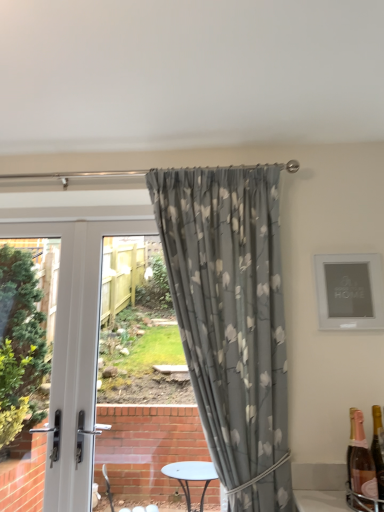
Question: Is gold metallic bottle at lower right, the 2th bottle when ordered from right to left, taller or shorter than white glossy door at left?

Choices:
 (A) short
 (B) tall

Answer: (A)

Question: Does point (364, 437) appear closer or farther from the camera than point (67, 499)?

Choices:
 (A) closer
 (B) farther

Answer: (A)

Question: Which object is the farthest from the matte silver picture frame at upper right?

Choices:
 (A) gray floral fabric curtain at center
 (B) white glossy door at left
 (C) pink glass bottle at lower right, which is counted as the 1th bottle, starting from the back
 (D) gold metallic bottle at lower right, acting as the first bottle starting from the front

Answer: (B)

Question: Estimate the real-world distances between objects in this image. Which object is farther from the gray floral fabric curtain at center?

Choices:
 (A) pink glass bottle at lower right, which is counted as the 1th bottle, starting from the back
 (B) matte silver picture frame at upper right
 (C) white glossy door at left
 (D) gold metallic bottle at lower right, the 2th bottle when ordered from right to left

Answer: (A)